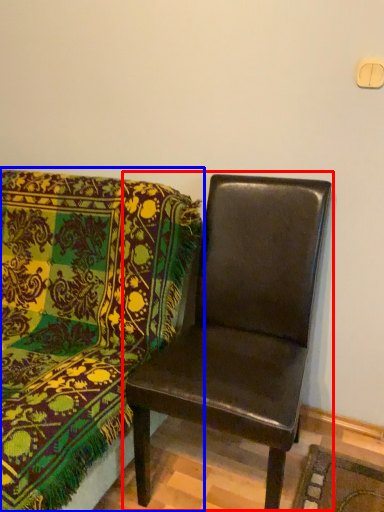
Question: Among these objects, which one is farthest to the camera, chair (highlighted by a red box) or chair (highlighted by a blue box)?

Choices:
 (A) chair
 (B) chair

Answer: (A)